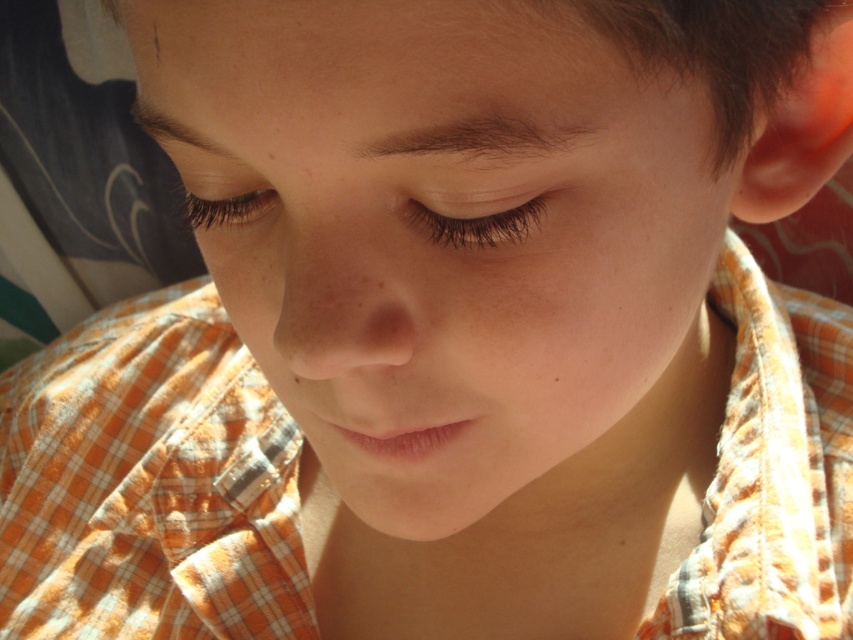
You are a photographer adjusting the focus of your camera. The subject has brown matte eyelashes at center. Where should you adjust the focus point to ensure the eyelashes are sharp?

The brown matte eyelashes at center are located at point [474,225], so you should adjust the focus point to that coordinate to ensure they are sharp.

You are taking a photo with a smartphone. The subject is standing 30 centimeters away from you. You want to focus on the point at point (527, 228). Will the focus be sharp if you focus on the subject 30 centimeters away?

The point 0.358, 019 is 27.79 centimeters from the camera, which is closer than the subject at 30 centimeters. Therefore, focusing on the subject 30 centimeters away will not ensure sharp focus on the point (527, 228).

Based on the scene description, which eyelash is positioned lower between the brown matte eyelashes at center and the black eyelashes at upper left?

The brown matte eyelashes at center is positioned below the black eyelashes at upper left, so it is lower.